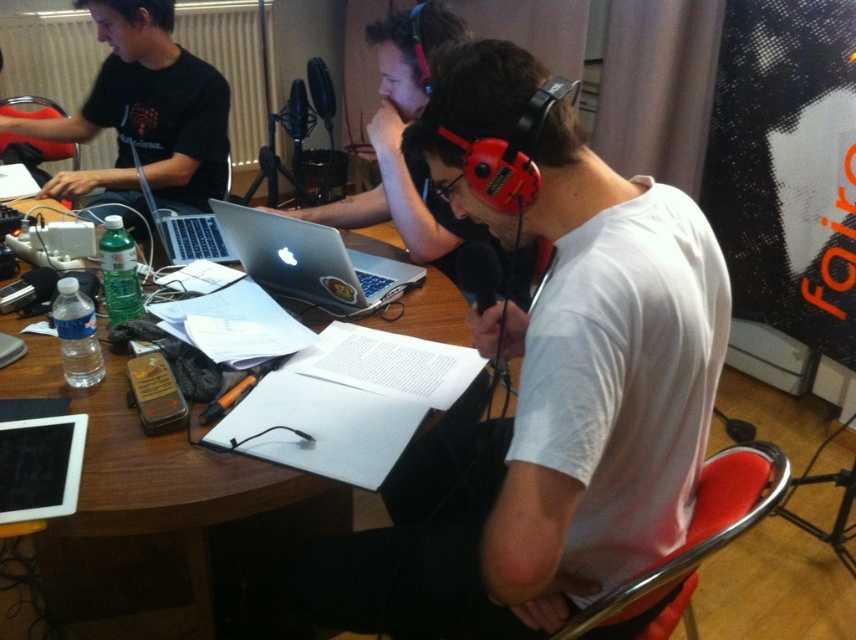
You are a photographer taking a picture of the podcast recording session. You want to ensure that both the matte black shirt at left and the silver metallic laptop at center are clearly visible in the frame. Based on their positions, which object should you focus on first to ensure both are in focus?

The matte black shirt at left is above the silver metallic laptop at center, so focusing on the matte black shirt at left first would ensure both are in focus since it is positioned higher up.

You are a photographer taking a picture of the podcast recording session. You need to ensure both the white cotton shirt at center and the silver metallic laptop at upper left are clearly visible in the frame. Given their positions and sizes, which object might require you to adjust your camera angle to include it properly?

The white cotton shirt at center is taller than the silver metallic laptop at upper left, so it might require adjusting the camera angle to ensure it fits within the frame.